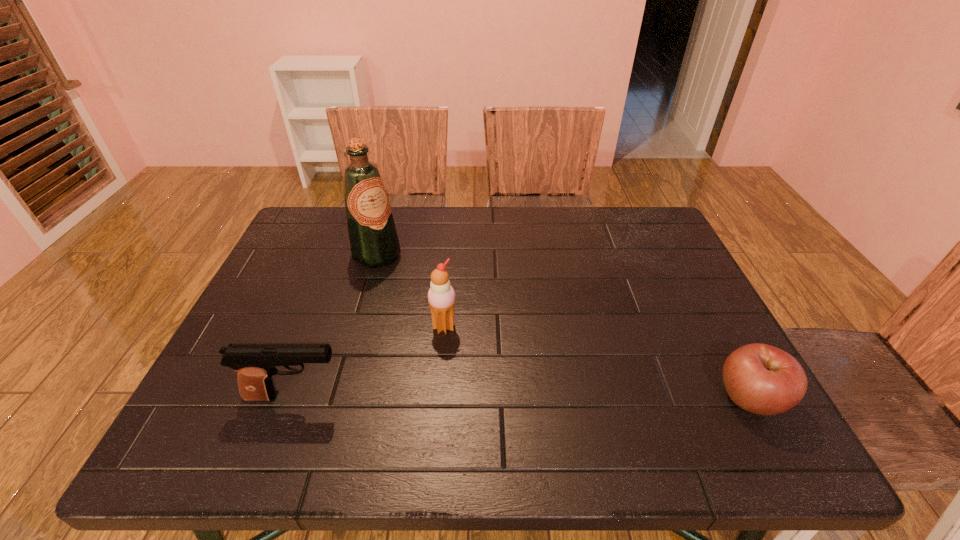
Identify the location of object at the near right corner. (762, 379).

In the image, there is a desktop. At what (x,y) coordinates should I click in order to perform the action: click on vacant space at the far edge. Please return your answer as a coordinate pair (x, y). Image resolution: width=960 pixels, height=540 pixels. Looking at the image, I should click on (452, 236).

I want to click on vacant space at the near edge, so click(x=331, y=404).

I want to click on vacant space at the right edge of the desktop, so click(x=712, y=342).

Image resolution: width=960 pixels, height=540 pixels. I want to click on free space at the far right corner of the desktop, so click(x=636, y=219).

Locate an element on the screen. The image size is (960, 540). free spot at the near right corner of the desktop is located at coordinates (706, 393).

You are a GUI agent. You are given a task and a screenshot of the screen. Output one action in this format:
    pyautogui.click(x=<x>, y=<y>)
    Task: Click on the vacant space that's between the rightmost object and the second shortest object
    This screenshot has width=960, height=540.
    Given the screenshot: What is the action you would take?
    pyautogui.click(x=522, y=397)

I want to click on blank region between the pistol and the rightmost object, so click(x=522, y=397).

This screenshot has width=960, height=540. What are the coordinates of `free space between the pistol and the farthest object` in the screenshot? It's located at (336, 326).

The height and width of the screenshot is (540, 960). In order to click on vacant point located between the second farthest object and the pistol in this screenshot , I will do `click(370, 361)`.